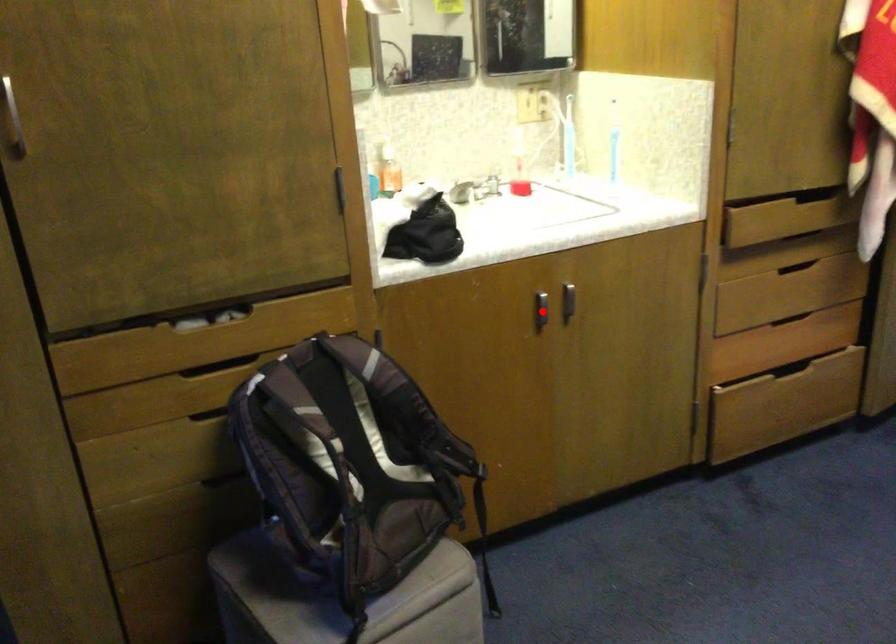
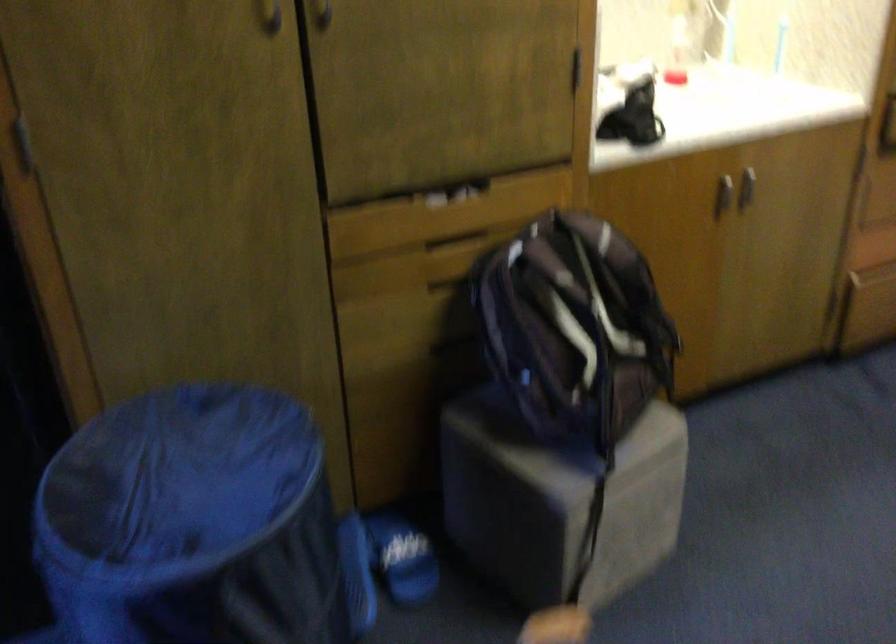
In the second image, find the point that corresponds to the highlighted location in the first image.

(722, 194)